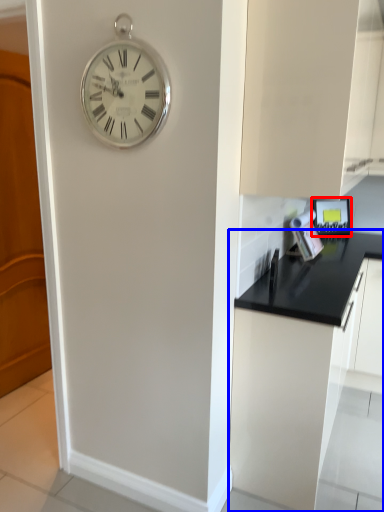
Question: Which of the following is the farthest to the observer, appliance (highlighted by a red box) or cabinetry (highlighted by a blue box)?

Choices:
 (A) appliance
 (B) cabinetry

Answer: (A)